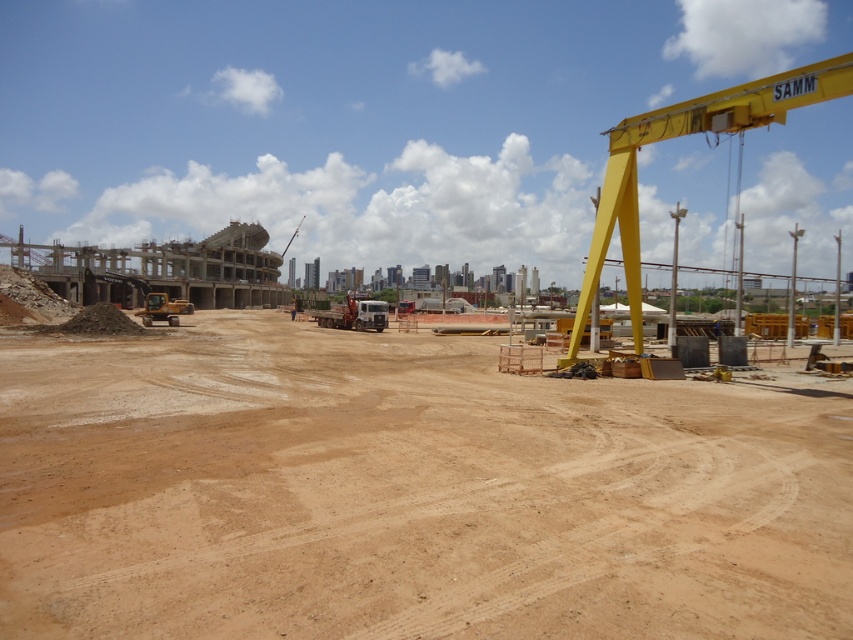
You are a construction worker needing to move materials from the yellow gantry crane labeled SAMM to the partially constructed building. The matte white truck at center is available. Based on its position, can the truck reach the crane and the building without moving from its current spot?

The matte white truck at center is located at point (354, 314), which is centrally positioned between the yellow gantry crane labeled SAMM on the right and the partially constructed building in the midground. This central position allows the truck to easily access both the crane and the building without needing to move from its current location.

You are a construction worker standing at the base of the crane labeled SAMM. You need to place a heavy beam at point A and a support column at point B. If point A corresponds to point (357, 310) and point B corresponds to point (154, 316), which point is closer to the crane?

Point B corresponds to point (154, 316) is closer to the crane labeled SAMM because it is in front of point A, which is behind point B.